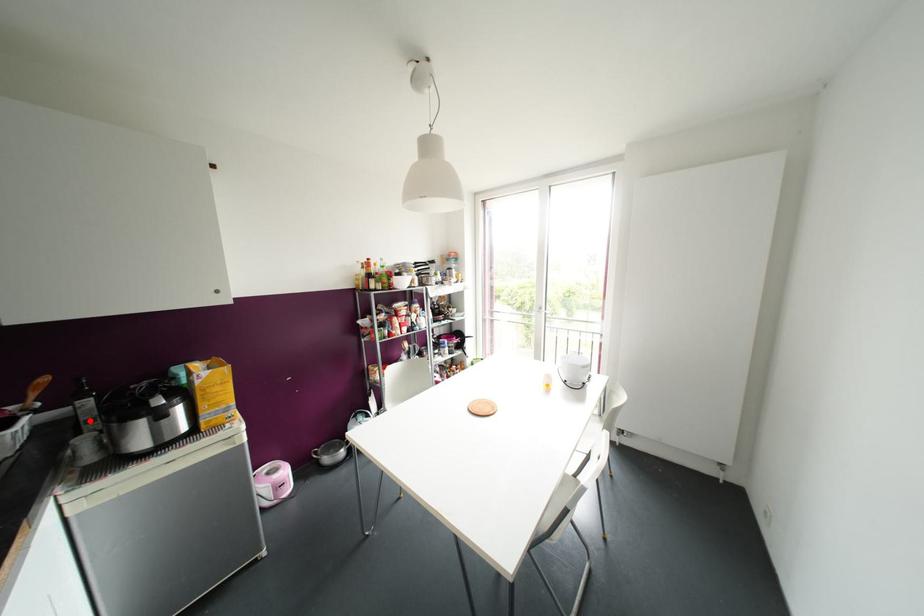
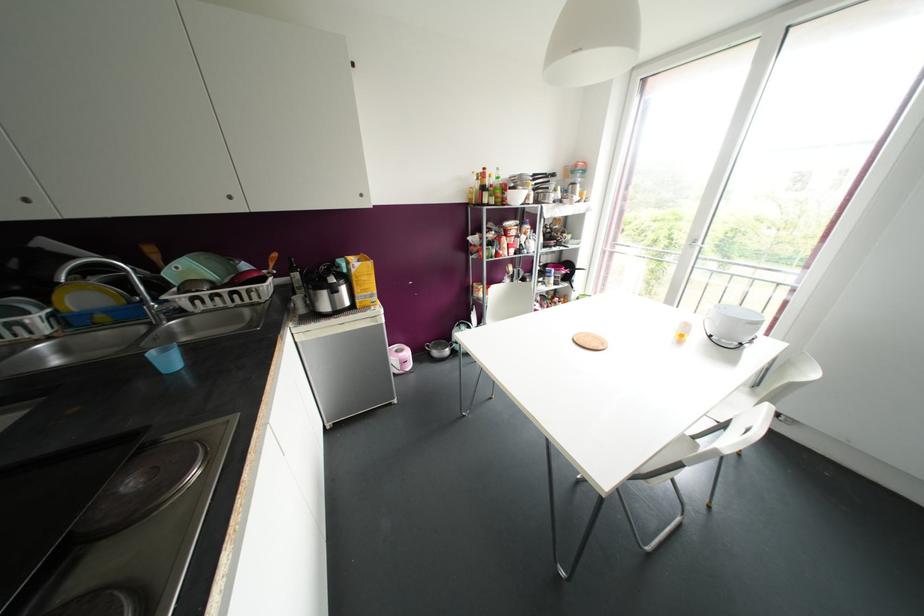
In the second image, find the point that corresponds to the highlighted location in the first image.

(298, 286)